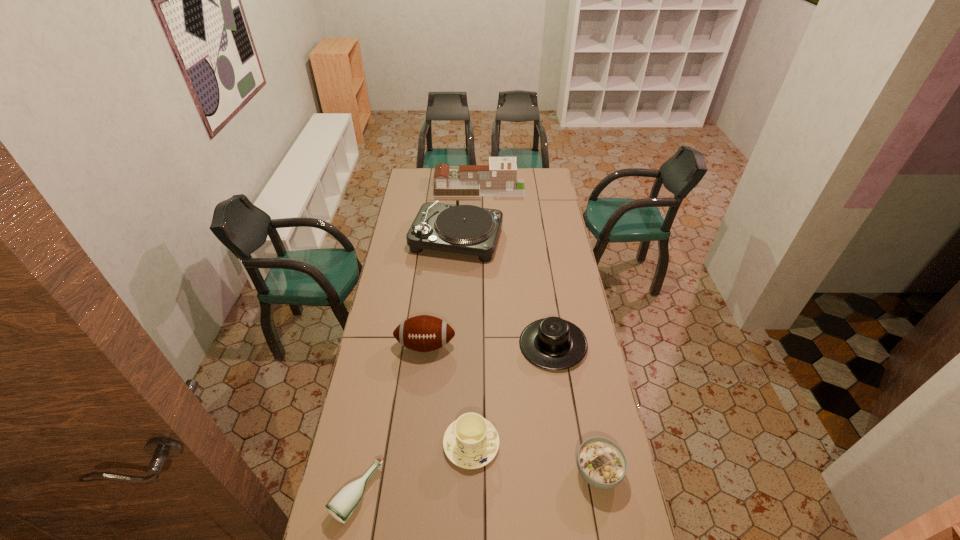
Where is `free space located on the laces of the football`? The height and width of the screenshot is (540, 960). free space located on the laces of the football is located at coordinates (420, 400).

At what (x,y) coordinates should I click in order to perform the action: click on blank space located on the back of the dress hat. Please return your answer as a coordinate pair (x, y). The width and height of the screenshot is (960, 540). Looking at the image, I should click on (541, 271).

The height and width of the screenshot is (540, 960). I want to click on vacant space situated on the handle side of the chinaware, so tap(532, 444).

This screenshot has width=960, height=540. I want to click on free location located on the left of the soup bowl, so click(x=482, y=472).

At what (x,y) coordinates should I click in order to perform the action: click on vacant point located 0.380m on the back of the shortest object. Please return your answer as a coordinate pair (x, y). This screenshot has width=960, height=540. Looking at the image, I should click on (381, 368).

Identify the location of object located at the far edge. This screenshot has height=540, width=960. (498, 179).

At what (x,y) coordinates should I click in order to perform the action: click on record player that is at the left edge. Please return your answer as a coordinate pair (x, y). Image resolution: width=960 pixels, height=540 pixels. Looking at the image, I should click on (466, 229).

Where is `football at the left edge`? football at the left edge is located at coordinates (423, 333).

Find the location of a particular element. The width and height of the screenshot is (960, 540). bottle situated at the left edge is located at coordinates (342, 505).

Find the location of a particular element. This screenshot has width=960, height=540. dress hat situated at the right edge is located at coordinates (552, 343).